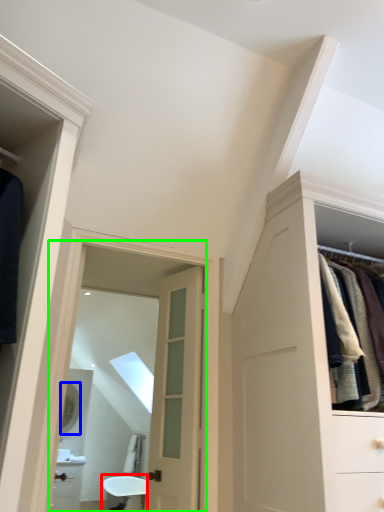
Question: Which object is the closest to the bath (highlighted by a red box)? Choose among these: mirror (highlighted by a blue box) or mirror (highlighted by a green box).

Choices:
 (A) mirror
 (B) mirror

Answer: (B)